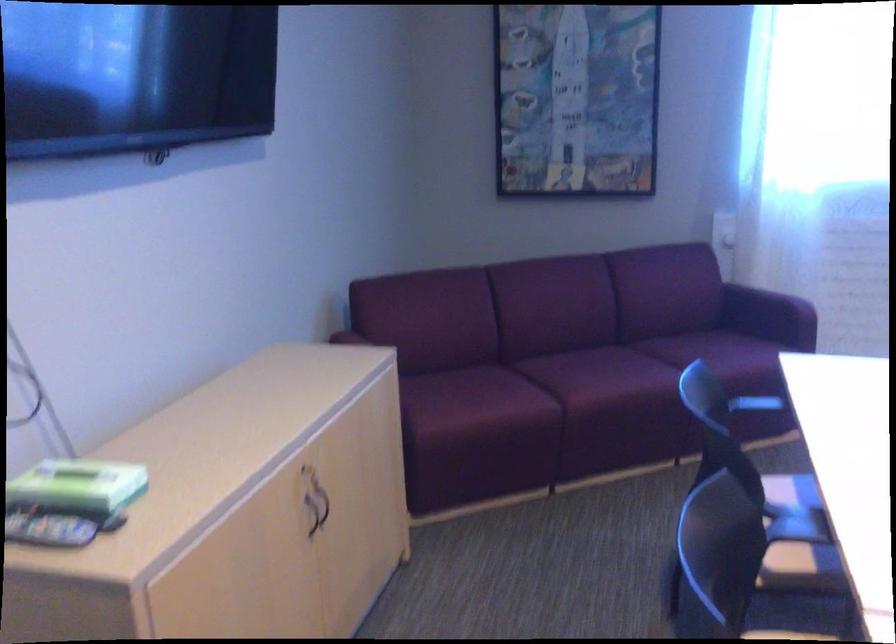
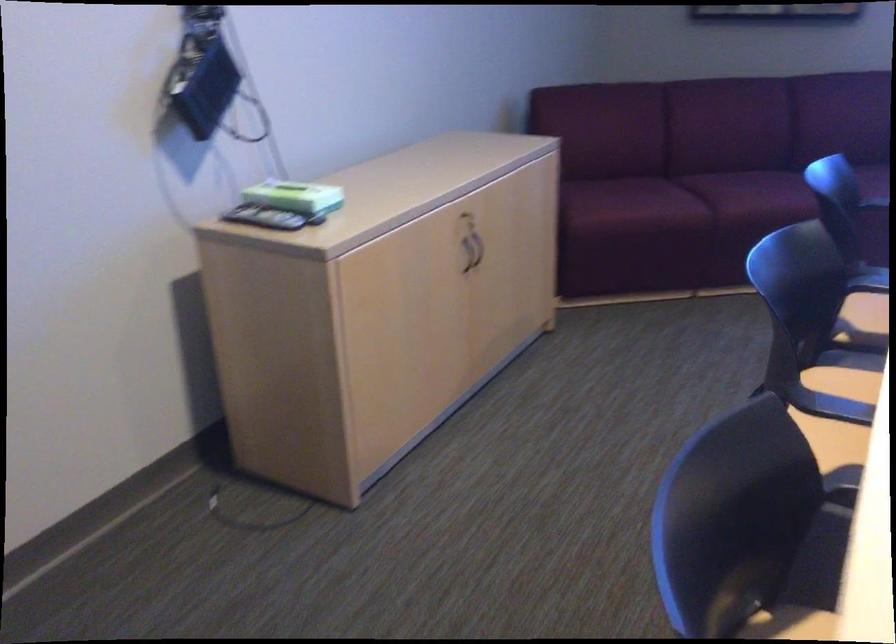
Locate, in the second image, the point that corresponds to [307,518] in the first image.

(464, 259)